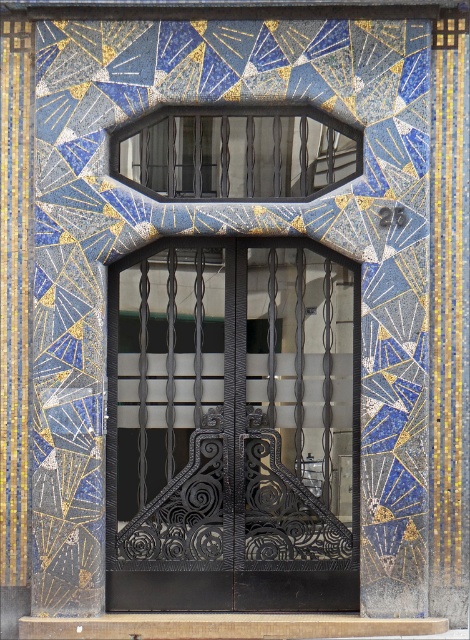
Is black wrought iron door at center further to the viewer compared to matte black glass at upper center?

That is False.

Does black wrought iron door at center have a larger size compared to matte black glass at upper center?

Yes.

Is point (269, 584) closer to camera compared to point (344, 170)?

Yes, it is.

At what (x,y) coordinates should I click in order to perform the action: click on black wrought iron door at center. Please return your answer as a coordinate pair (x, y). Image resolution: width=470 pixels, height=640 pixels. Looking at the image, I should click on (233, 429).